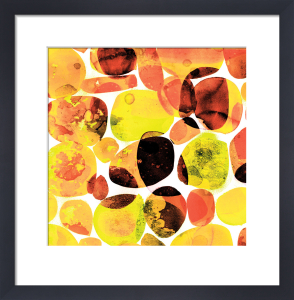
You are a GUI agent. You are given a task and a screenshot of the screen. Output one action in this format:
    pyautogui.click(x=<x>, y=<y>)
    Task: Click on the art piece
    The image size is (294, 300).
    Given the screenshot: What is the action you would take?
    pyautogui.click(x=153, y=148)